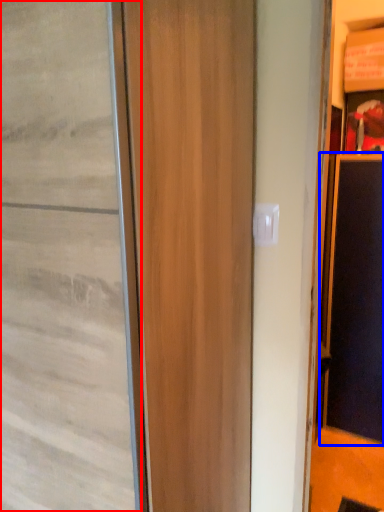
Question: Which object appears closest to the camera in this image, door (highlighted by a red box) or screen door (highlighted by a blue box)?

Choices:
 (A) door
 (B) screen door

Answer: (A)